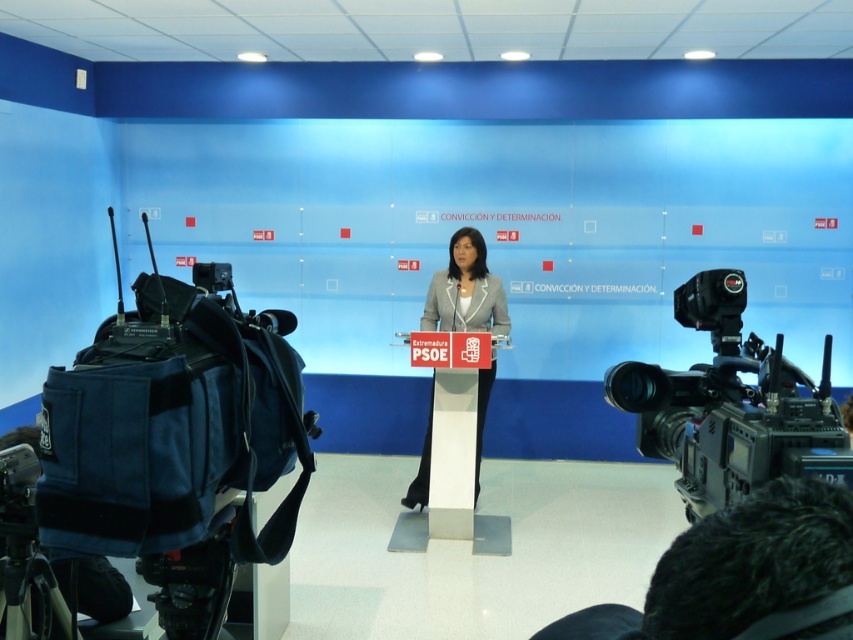
Who is taller, blue fabric video camera at left or light gray fabric jacket at center?

light gray fabric jacket at center

Who is more forward, [225,294] or [503,323]?

Positioned in front is point [225,294].

Find the location of a particular element. The height and width of the screenshot is (640, 853). blue fabric video camera at left is located at coordinates (175, 440).

Does black plastic video camera at right appear on the left side of light gray fabric jacket at center?

Incorrect, black plastic video camera at right is not on the left side of light gray fabric jacket at center.

Does black plastic video camera at right come behind light gray fabric jacket at center?

No.

Find the location of a particular element. black plastic video camera at right is located at coordinates (730, 404).

This screenshot has height=640, width=853. I want to click on black plastic video camera at right, so click(x=730, y=404).

Does black plastic video camera at right have a lesser height compared to black fabric tripod at lower left?

Incorrect, black plastic video camera at right's height does not fall short of black fabric tripod at lower left's.

Does black plastic video camera at right lie behind black fabric tripod at lower left?

No, it is in front of black fabric tripod at lower left.

Locate an element on the screen. The height and width of the screenshot is (640, 853). black plastic video camera at right is located at coordinates (730, 404).

Locate an element on the screen. The image size is (853, 640). black plastic video camera at right is located at coordinates (730, 404).